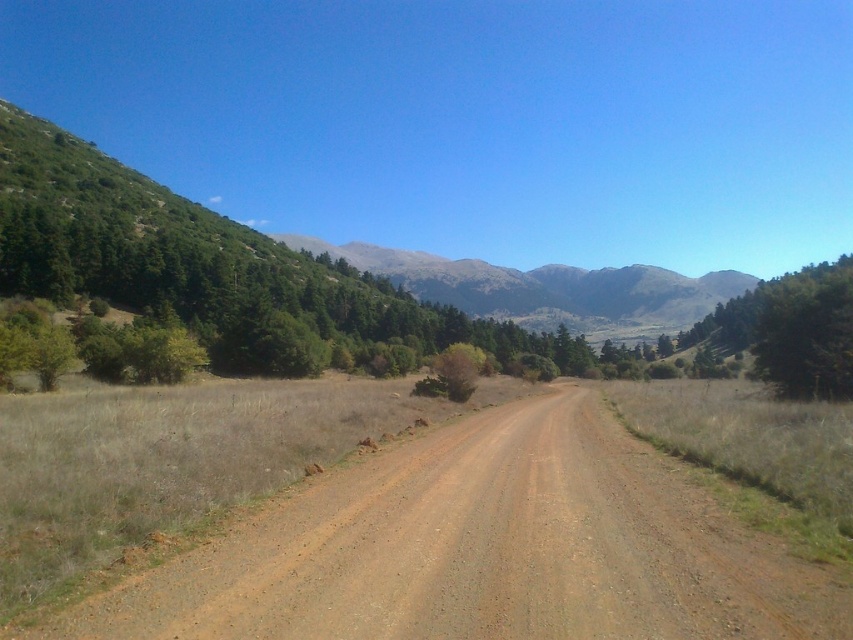
Question: From the image, what is the correct spatial relationship of brown gravel road at center in relation to green forested mountain at upper left?

Choices:
 (A) below
 (B) above

Answer: (A)

Question: Considering the real-world distances, which object is farthest from the brown gravel road at center?

Choices:
 (A) green forested mountain at center
 (B) green forested mountain at upper left

Answer: (A)

Question: Which point appears closest to the camera in this image?

Choices:
 (A) pos(422,278)
 (B) pos(549,298)
 (C) pos(416,614)

Answer: (C)

Question: Does brown gravel road at center have a smaller size compared to green forested mountain at center?

Choices:
 (A) no
 (B) yes

Answer: (B)

Question: Which of the following is the farthest from the observer?

Choices:
 (A) green forested mountain at upper left
 (B) green forested mountain at center
 (C) brown gravel road at center

Answer: (B)

Question: Does green forested mountain at upper left come behind green forested mountain at center?

Choices:
 (A) no
 (B) yes

Answer: (A)